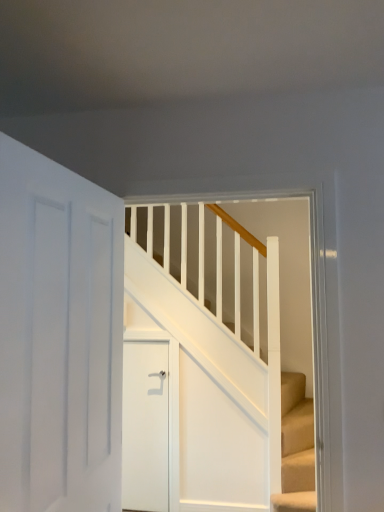
Measure the distance between point (224, 441) and camera.

A distance of 9.84 feet exists between point (224, 441) and camera.

The height and width of the screenshot is (512, 384). What do you see at coordinates (59, 336) in the screenshot?
I see `white matte door at left, the 1th door positioned from the front` at bounding box center [59, 336].

Locate an element on the screen. This screenshot has height=512, width=384. white wooden stairs at center is located at coordinates (207, 403).

Is white wooden stairs at center facing away from white matte door at left, the 1th door positioned from the front?

No, white matte door at left, the 1th door positioned from the front, is not at the back of white wooden stairs at center.

From a real-world perspective, which object stands above the other?

In real-world perspective, white matte door at left, the 1th door positioned from the front, is above.

Is white wooden stairs at center outside of white matte door at left, which appears as the second door when viewed from the back?

Yes, white wooden stairs at center is located beyond the bounds of white matte door at left, which appears as the second door when viewed from the back.

From a real-world perspective, which is physically above, white matte door at left, which appears as the second door when viewed from the back, or white matte door at center, positioned as the second door in front-to-back order?

white matte door at left, which appears as the second door when viewed from the back, from a real-world perspective.

Based on the photo, does white matte door at left, the 1th door positioned from the front, turn towards white matte door at center, the first door from the back?

No, white matte door at left, the 1th door positioned from the front, is not facing towards white matte door at center, the first door from the back.

Between white matte door at left, which appears as the second door when viewed from the back, and white matte door at center, the first door from the back, which one is positioned in front?

white matte door at left, which appears as the second door when viewed from the back, is closer to the camera.

Is point (89, 227) closer to viewer compared to point (129, 396)?

Yes, point (89, 227) is closer to viewer.

Which is behind, point (151, 387) or point (58, 183)?

The point (151, 387) is behind.

Based on the photo, which is more to the right, white matte door at center, the first door from the back, or white matte door at left, the 1th door positioned from the front?

From the viewer's perspective, white matte door at center, the first door from the back, appears more on the right side.

Is white matte door at center, positioned as the second door in front-to-back order, taller or shorter than white matte door at left, the 1th door positioned from the front?

white matte door at center, positioned as the second door in front-to-back order, is shorter than white matte door at left, the 1th door positioned from the front.

Is white matte door at center, the first door from the back, with white matte door at left, which appears as the second door when viewed from the back?

white matte door at center, the first door from the back, is not next to white matte door at left, which appears as the second door when viewed from the back, and they're not touching.

How far apart are white matte door at left, the 1th door positioned from the front, and white wooden stairs at center?

They are 1.67 meters apart.

In the image, there is a white matte door at left, which appears as the second door when viewed from the back. Identify the location of stairs below it (from a real-world perspective). (207, 403).

Considering the sizes of objects white matte door at left, the 1th door positioned from the front, and white wooden stairs at center in the image provided, who is smaller, white matte door at left, the 1th door positioned from the front, or white wooden stairs at center?

white matte door at left, the 1th door positioned from the front, is smaller.

Looking at this image, from a real-world perspective, between white matte door at left, which appears as the second door when viewed from the back, and white wooden stairs at center, who is vertically lower?

white wooden stairs at center is physically lower.

Is white wooden stairs at center facing away from white matte door at center, positioned as the second door in front-to-back order?

That's right, white wooden stairs at center is facing away from white matte door at center, positioned as the second door in front-to-back order.

In the scene shown: Considering the relative sizes of white wooden stairs at center and white matte door at center, the first door from the back, in the image provided, is white wooden stairs at center bigger than white matte door at center, the first door from the back,?

Yes, white wooden stairs at center is bigger than white matte door at center, the first door from the back.

Measure the distance from white wooden stairs at center to white matte door at center, the first door from the back.

The distance of white wooden stairs at center from white matte door at center, the first door from the back, is 10.96 inches.

Can white matte door at center, positioned as the second door in front-to-back order, be found inside white wooden stairs at center?

No, white matte door at center, positioned as the second door in front-to-back order, is not surrounded by white wooden stairs at center.

The width and height of the screenshot is (384, 512). I want to click on stairs above the white matte door at center, the first door from the back (from a real-world perspective), so [x=207, y=403].

From a real-world perspective, is white matte door at center, the first door from the back, positioned above or below white wooden stairs at center?

Clearly, from a real-world perspective, white matte door at center, the first door from the back, is below white wooden stairs at center.

Is white matte door at center, the first door from the back, positioned far away from white wooden stairs at center?

No.

In the scene shown: What's the angular difference between white matte door at center, the first door from the back, and white wooden stairs at center's facing directions?

The facing directions of white matte door at center, the first door from the back, and white wooden stairs at center are 1.48 degrees apart.

Locate an element on the screen. This screenshot has width=384, height=512. door located above the white wooden stairs at center (from a real-world perspective) is located at coordinates (59, 336).

Image resolution: width=384 pixels, height=512 pixels. I want to click on door that is in front of the white matte door at center, the first door from the back, so click(59, 336).

Considering their positions, is white matte door at left, the 1th door positioned from the front, positioned further to white matte door at center, positioned as the second door in front-to-back order, than white wooden stairs at center?

white matte door at left, the 1th door positioned from the front, is positioned further to the anchor white matte door at center, positioned as the second door in front-to-back order.

Which object lies further to the anchor point white matte door at left, which appears as the second door when viewed from the back, white wooden stairs at center or white matte door at center, the first door from the back?

white matte door at center, the first door from the back, is further to white matte door at left, which appears as the second door when viewed from the back.

Estimate the real-world distances between objects in this image. Which object is further from white wooden stairs at center, white matte door at center, the first door from the back, or white matte door at left, which appears as the second door when viewed from the back?

white matte door at left, which appears as the second door when viewed from the back, is positioned further to the anchor white wooden stairs at center.

Estimate the real-world distances between objects in this image. Which object is further from white wooden stairs at center, white matte door at left, the 1th door positioned from the front, or white matte door at center, positioned as the second door in front-to-back order?

white matte door at left, the 1th door positioned from the front, is further to white wooden stairs at center.

Looking at the image, which one is located closer to white matte door at left, the 1th door positioned from the front, white matte door at center, the first door from the back, or white wooden stairs at center?

white wooden stairs at center is closer to white matte door at left, the 1th door positioned from the front.

Looking at the image, which one is located closer to white matte door at center, the first door from the back, white wooden stairs at center or white matte door at left, the 1th door positioned from the front?

white wooden stairs at center lies closer to white matte door at center, the first door from the back, than the other object.

The width and height of the screenshot is (384, 512). Find the location of `stairs positioned between white matte door at left, which appears as the second door when viewed from the back, and white matte door at center, positioned as the second door in front-to-back order, from near to far`. stairs positioned between white matte door at left, which appears as the second door when viewed from the back, and white matte door at center, positioned as the second door in front-to-back order, from near to far is located at coordinates (207, 403).